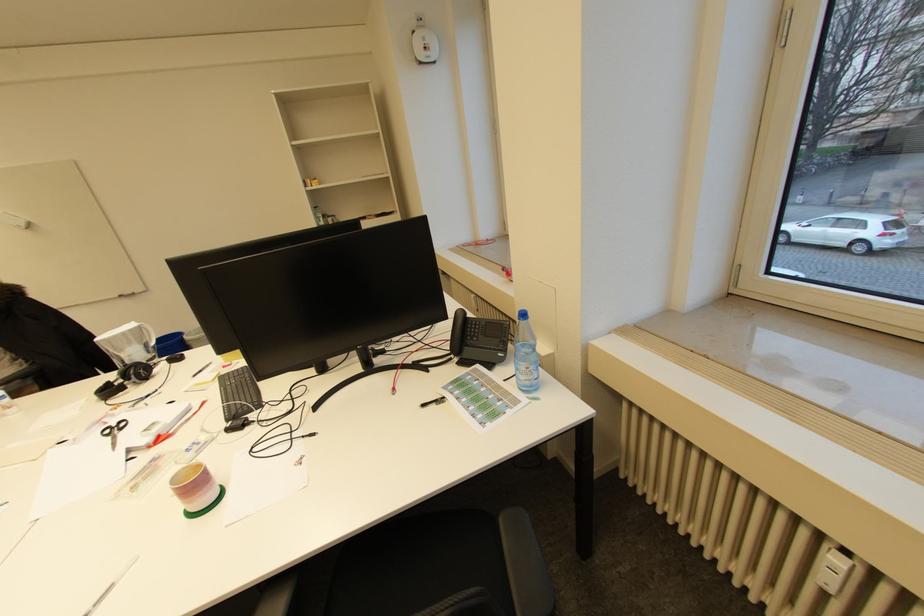
Find the location of `white radiator dial`. white radiator dial is located at coordinates (833, 572).